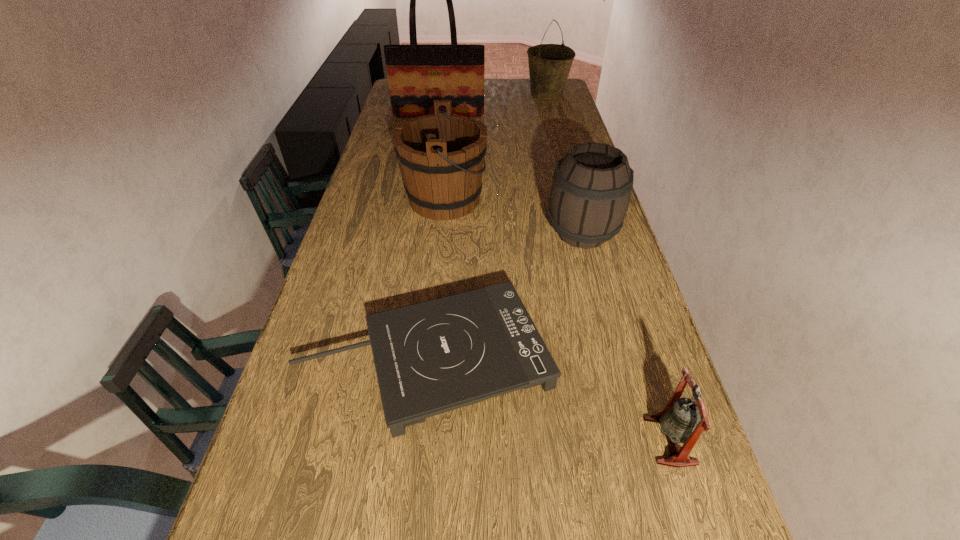
Locate an element on the screen. vacant region located 0.220m on the back of the hotplate is located at coordinates (439, 243).

Find the location of `object that is positioned at the far edge`. object that is positioned at the far edge is located at coordinates (549, 64).

Where is `shopping bag positioned at the left edge`? The width and height of the screenshot is (960, 540). shopping bag positioned at the left edge is located at coordinates (417, 75).

Where is `hotplate that is positioned at the left edge`? This screenshot has width=960, height=540. hotplate that is positioned at the left edge is located at coordinates (431, 357).

This screenshot has height=540, width=960. Find the location of `bell that is at the right edge`. bell that is at the right edge is located at coordinates (680, 422).

Locate an element on the screen. This screenshot has width=960, height=540. object that is positioned at the far right corner is located at coordinates (549, 64).

You are a GUI agent. You are given a task and a screenshot of the screen. Output one action in this format:
    pyautogui.click(x=<x>, y=<y>)
    Task: Click on the vacant space at the left edge of the desktop
    The height and width of the screenshot is (540, 960).
    Given the screenshot: What is the action you would take?
    pyautogui.click(x=388, y=144)

Where is `vacant position at the right edge of the desktop`? The width and height of the screenshot is (960, 540). vacant position at the right edge of the desktop is located at coordinates (567, 148).

I want to click on vacant space that's between the leftmost wine bucket and the farthest object, so click(x=495, y=146).

Locate an element on the screen. unoccupied position between the bell and the leftmost wine bucket is located at coordinates (558, 320).